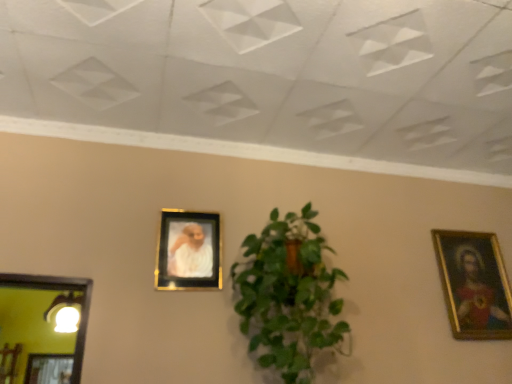
Question: From the image's perspective, is gold metallic picture frame at center, placed as the 1th picture frame when sorted from left to right, under green leafy plant at center?

Choices:
 (A) no
 (B) yes

Answer: (A)

Question: Could you tell me if gold metallic picture frame at center, the 2th picture frame when ordered from right to left, is turned towards green leafy plant at center?

Choices:
 (A) yes
 (B) no

Answer: (B)

Question: Does gold metallic picture frame at center, placed as the 1th picture frame when sorted from left to right, have a smaller size compared to green leafy plant at center?

Choices:
 (A) yes
 (B) no

Answer: (A)

Question: Is the depth of gold metallic picture frame at center, the 2th picture frame when ordered from right to left, less than that of green leafy plant at center?

Choices:
 (A) yes
 (B) no

Answer: (B)

Question: Does gold metallic picture frame at center, which is counted as the second picture frame, starting from the back, have a lesser width compared to green leafy plant at center?

Choices:
 (A) yes
 (B) no

Answer: (A)

Question: Is green leafy plant at center inside gold metallic picture frame at center, the 2th picture frame when ordered from right to left?

Choices:
 (A) no
 (B) yes

Answer: (A)

Question: Could you tell me if gold metallic picture frame at center, which is counted as the second picture frame, starting from the back, is facing gold-framed painting at right, which appears as the 1th picture frame when viewed from the back?

Choices:
 (A) no
 (B) yes

Answer: (A)

Question: Considering the relative sizes of gold metallic picture frame at center, placed as the 1th picture frame when sorted from left to right, and gold-framed painting at right, the 1th picture frame from the right, in the image provided, is gold metallic picture frame at center, placed as the 1th picture frame when sorted from left to right, bigger than gold-framed painting at right, the 1th picture frame from the right,?

Choices:
 (A) yes
 (B) no

Answer: (B)

Question: Is gold metallic picture frame at center, placed as the 1th picture frame when sorted from left to right, to the right of gold-framed painting at right, which appears as the 1th picture frame when viewed from the back, from the viewer's perspective?

Choices:
 (A) no
 (B) yes

Answer: (A)

Question: From the image's perspective, is gold metallic picture frame at center, placed as the 1th picture frame when sorted from left to right, below gold-framed painting at right, which appears as the 1th picture frame when viewed from the back?

Choices:
 (A) no
 (B) yes

Answer: (A)

Question: From a real-world perspective, is gold metallic picture frame at center, which is counted as the second picture frame, starting from the back, positioned over gold-framed painting at right, the 1th picture frame from the right, based on gravity?

Choices:
 (A) yes
 (B) no

Answer: (A)

Question: Does gold metallic picture frame at center, placed as the 1th picture frame when sorted from left to right, have a greater height compared to gold-framed painting at right, which is counted as the second picture frame, starting from the front?

Choices:
 (A) yes
 (B) no

Answer: (B)

Question: Can you confirm if gold-framed painting at right, the second picture frame from the left, is positioned to the right of gold metallic picture frame at center, placed as the 1th picture frame when sorted from left to right?

Choices:
 (A) no
 (B) yes

Answer: (B)